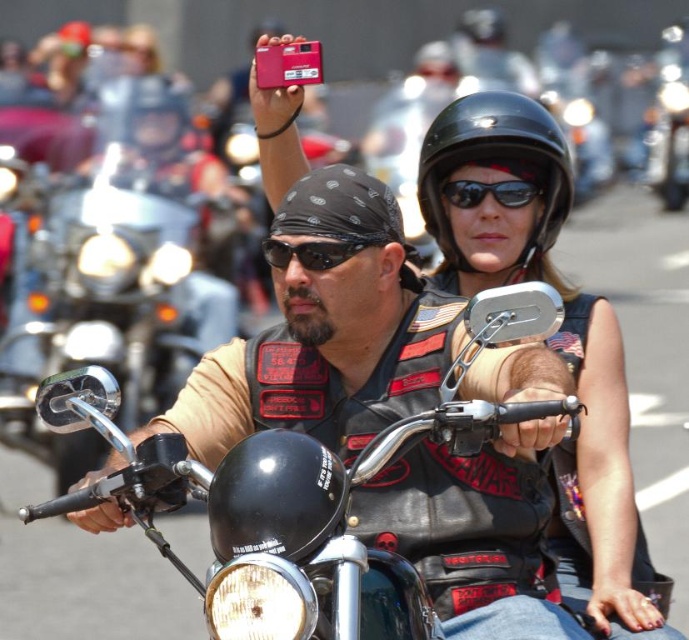
Can you confirm if matte black helmet at upper center is thinner than black matte sunglasses at upper center?

In fact, matte black helmet at upper center might be wider than black matte sunglasses at upper center.

Find the location of `matte black helmet at upper center`. matte black helmet at upper center is located at coordinates (154, 120).

Who is taller, black glossy helmet at upper center or metallic silver motorcycle at center?

metallic silver motorcycle at center

Can you confirm if black glossy helmet at upper center is shorter than metallic silver motorcycle at center?

Yes, black glossy helmet at upper center is shorter than metallic silver motorcycle at center.

Does point (431, 205) come closer to viewer compared to point (657, 182)?

Yes.

Locate an element on the screen. black glossy helmet at upper center is located at coordinates (495, 164).

Which is in front, point (220, 432) or point (164, 160)?

Point (220, 432) is in front.

Is leather vest at center smaller than matte black helmet at upper center?

No, leather vest at center is not smaller than matte black helmet at upper center.

Describe the element at coordinates (362, 307) in the screenshot. Image resolution: width=689 pixels, height=640 pixels. I see `leather vest at center` at that location.

What are the coordinates of `leather vest at center` in the screenshot? It's located at (362, 307).